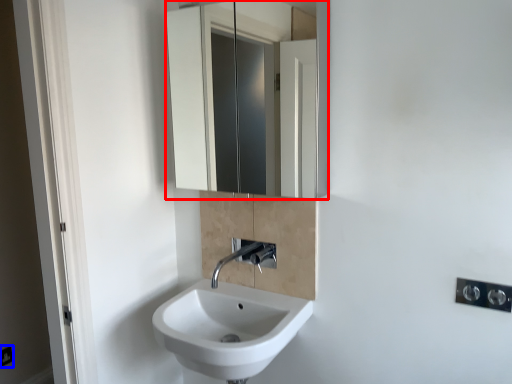
Question: Which object appears farthest to the camera in this image, mirror (highlighted by a red box) or electric outlet (highlighted by a blue box)?

Choices:
 (A) mirror
 (B) electric outlet

Answer: (B)